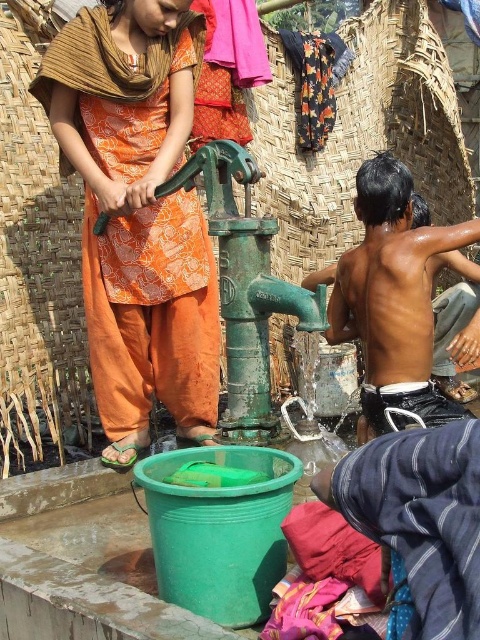
Is orange printed fabric at center shorter than shiny black skin at right?

In fact, orange printed fabric at center may be taller than shiny black skin at right.

Between point (130, 442) and point (382, 189), which one is positioned behind?

The point (382, 189) is more distant.

Find the location of a particular element. This screenshot has height=640, width=480. orange printed fabric at center is located at coordinates (137, 214).